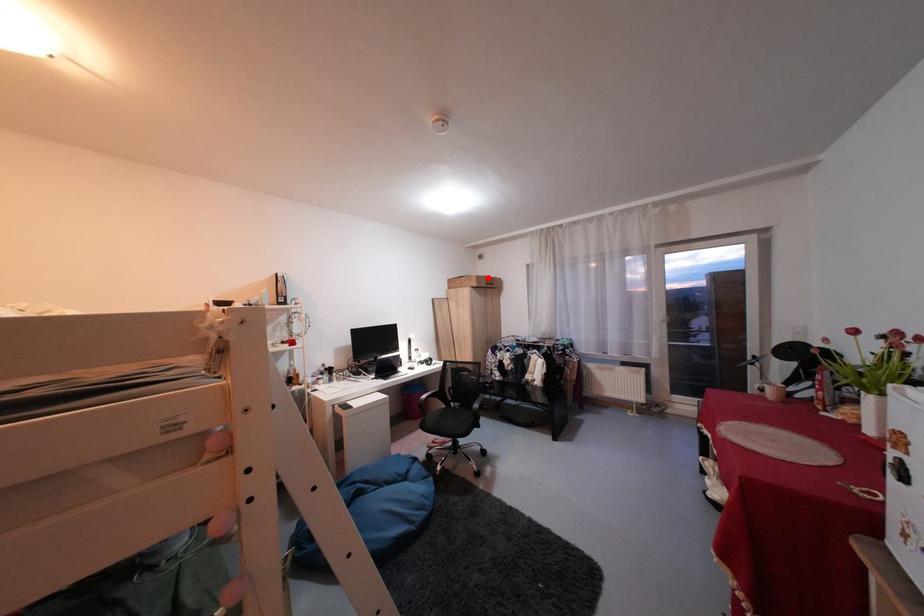
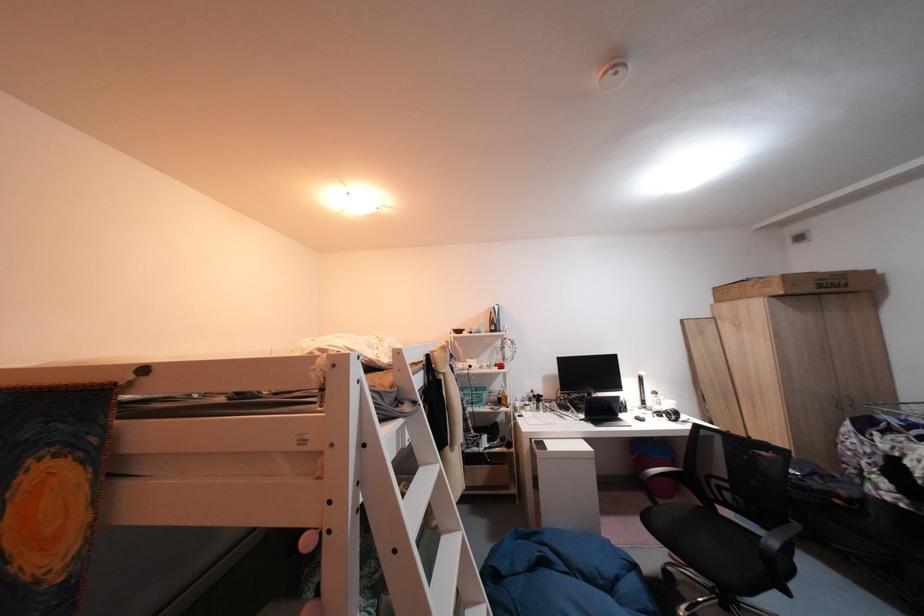
Find the pixel in the second image that matches the highlighted location in the first image.

(794, 278)